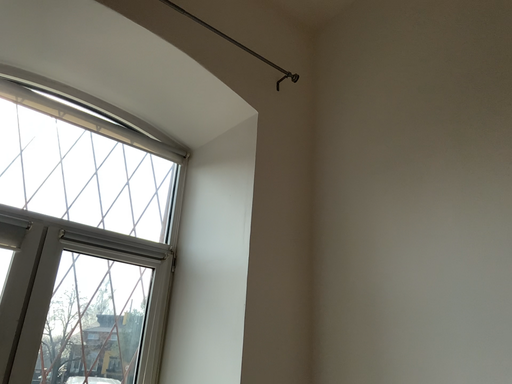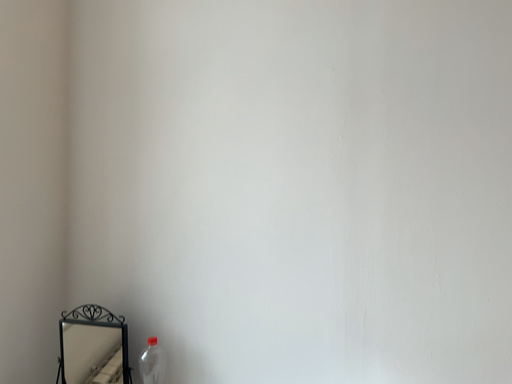
Question: Which way did the camera rotate in the video?

Choices:
 (A) rotated left
 (B) rotated right

Answer: (B)